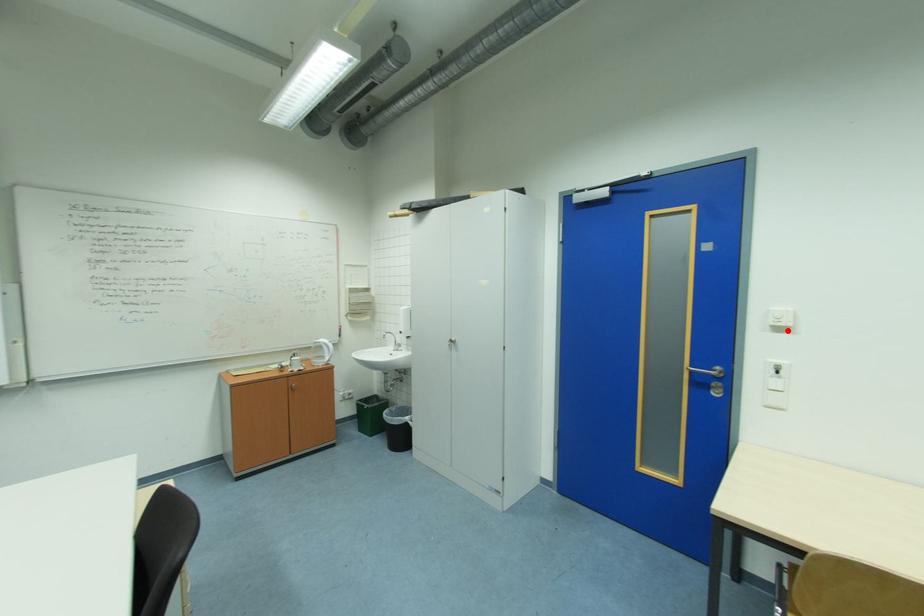
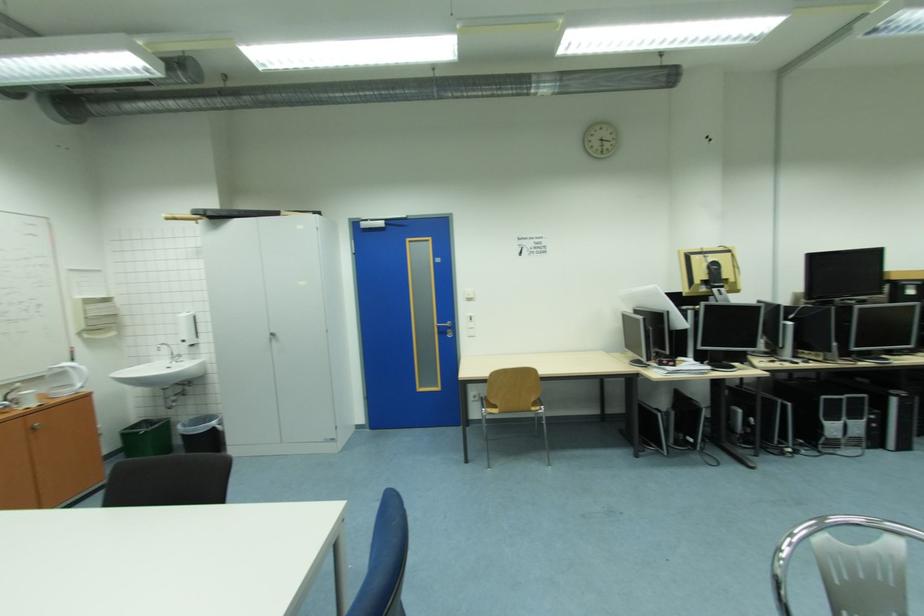
The point at the highlighted location is marked in the first image. Where is the corresponding point in the second image?

(477, 301)